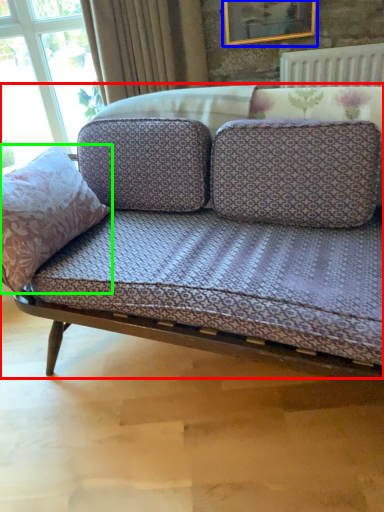
Question: Based on their relative distances, which object is farther from studio couch (highlighted by a red box)? Choose from picture frame (highlighted by a blue box) and throw pillow (highlighted by a green box).

Choices:
 (A) picture frame
 (B) throw pillow

Answer: (A)